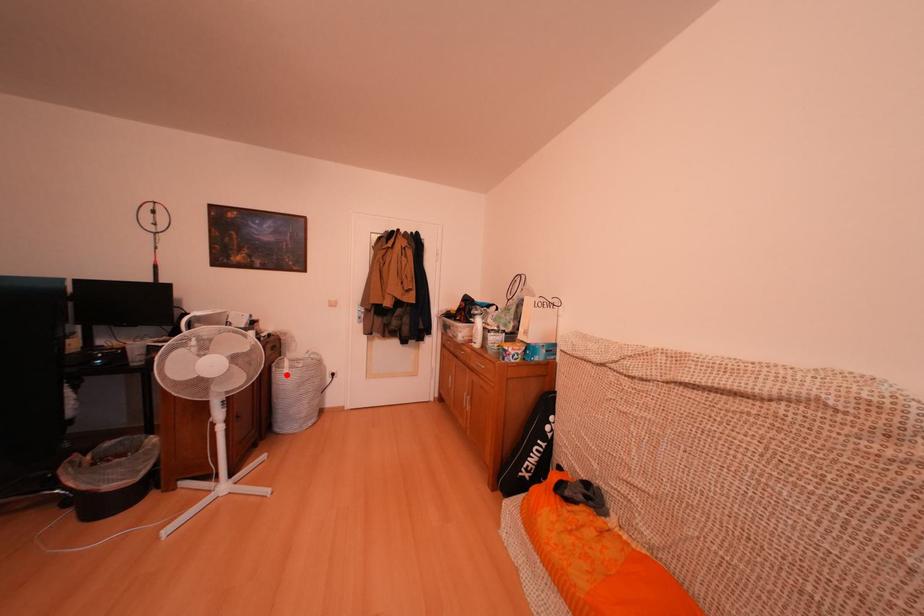
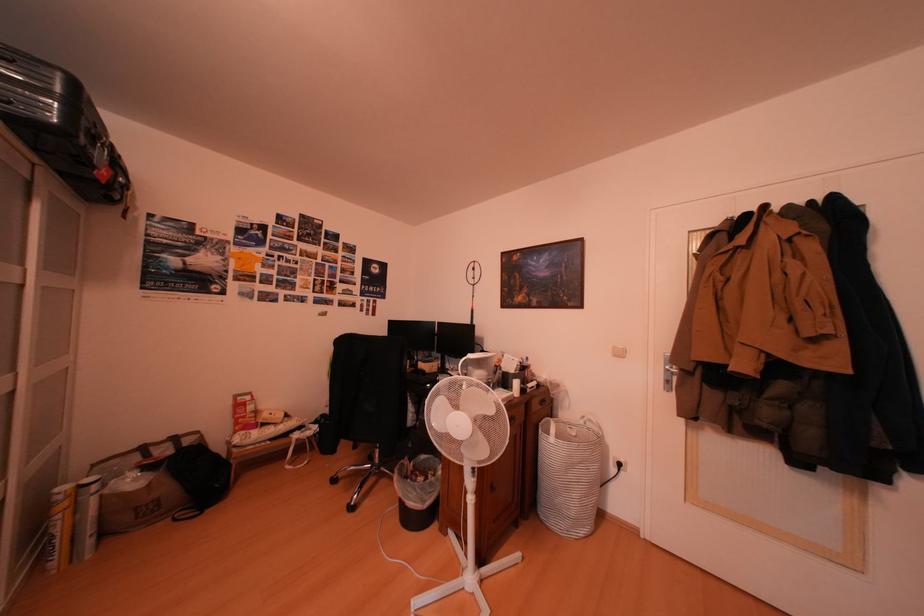
Question: I am providing you with two images of the same scene from different viewpoints. In image1, a red point is highlighted. Considering the same 3D point in image2, which of the following is correct?

Choices:
 (A) It is closer
 (B) It is farther

Answer: (B)